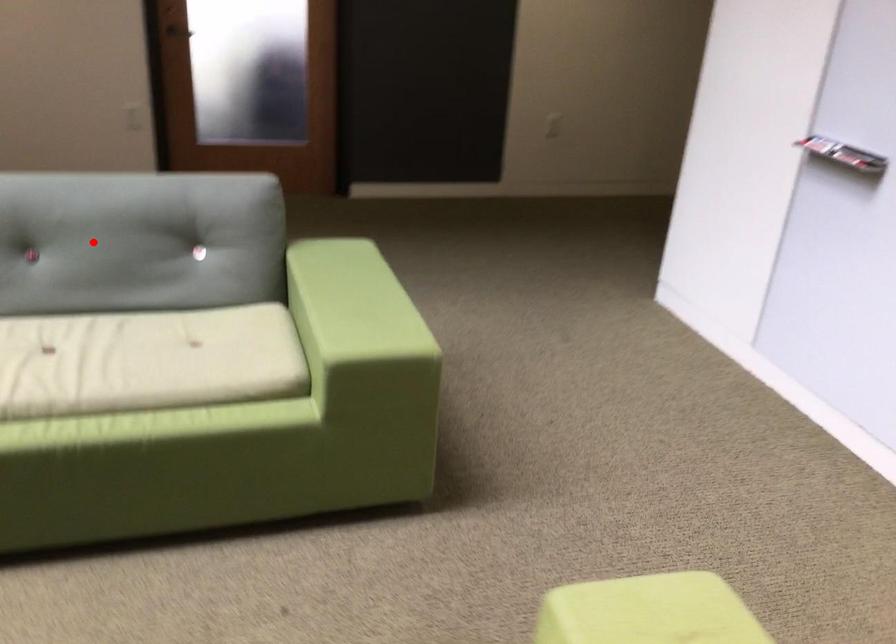
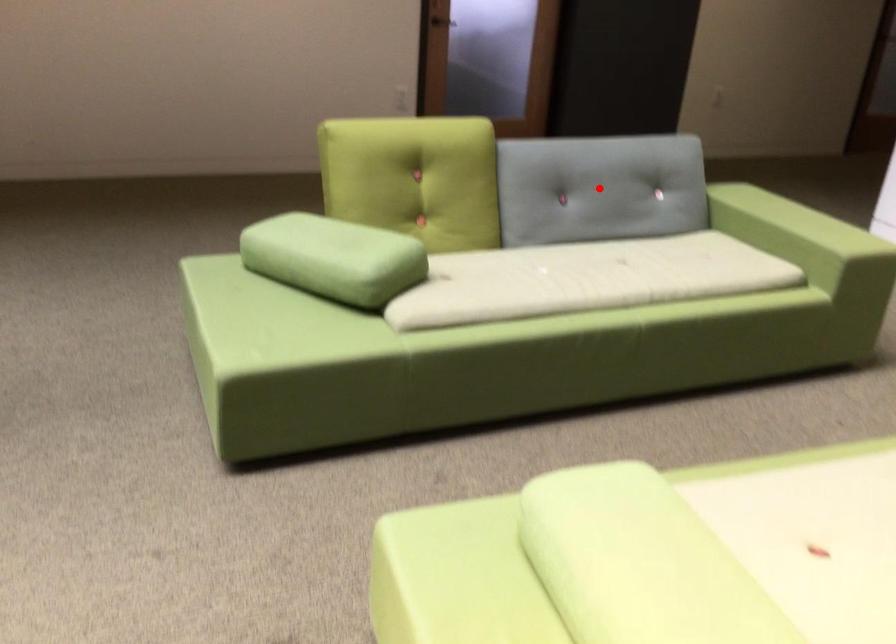
I am providing you with two images of the same scene from different viewpoints. A red point is marked on the first image and another point is marked on the second image. Is the red point in image1 aligned with the point shown in image2?

Yes